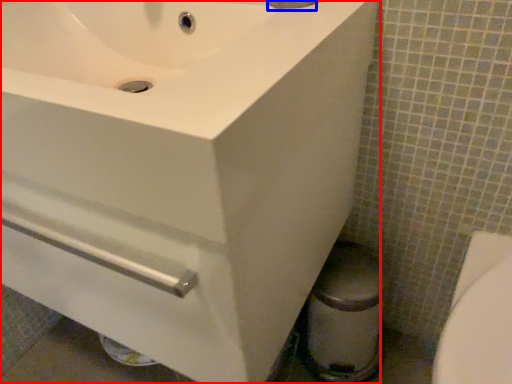
Question: Which object is closer to the camera taking this photo, sink (highlighted by a red box) or plumbing fixture (highlighted by a blue box)?

Choices:
 (A) sink
 (B) plumbing fixture

Answer: (A)